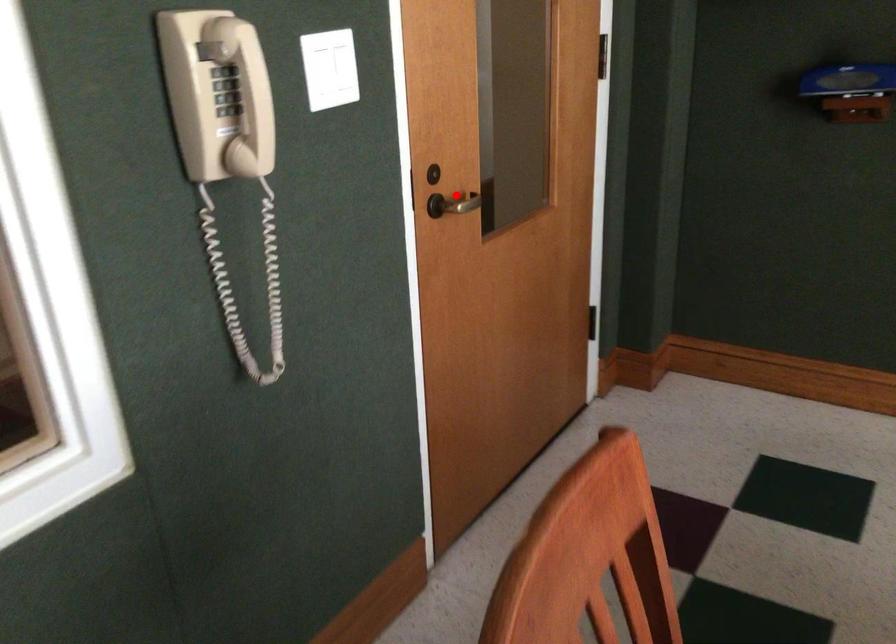
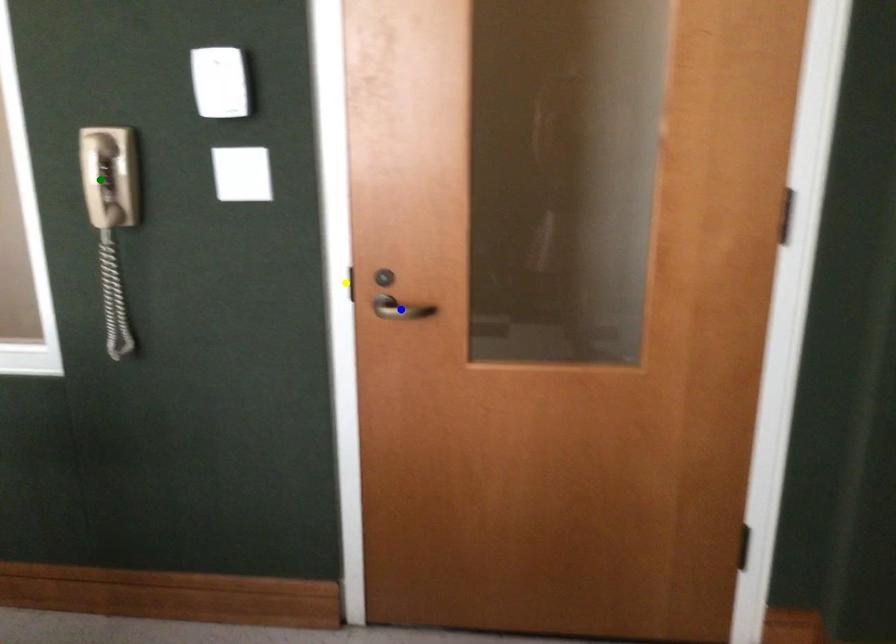
Question: I am providing you with two images of the same scene from different viewpoints. A red point is marked on the first image. You are given multiple points on the second image. Which mark in image 2 goes with the point in image 1?

Choices:
 (A) yellow point
 (B) green point
 (C) blue point

Answer: (C)